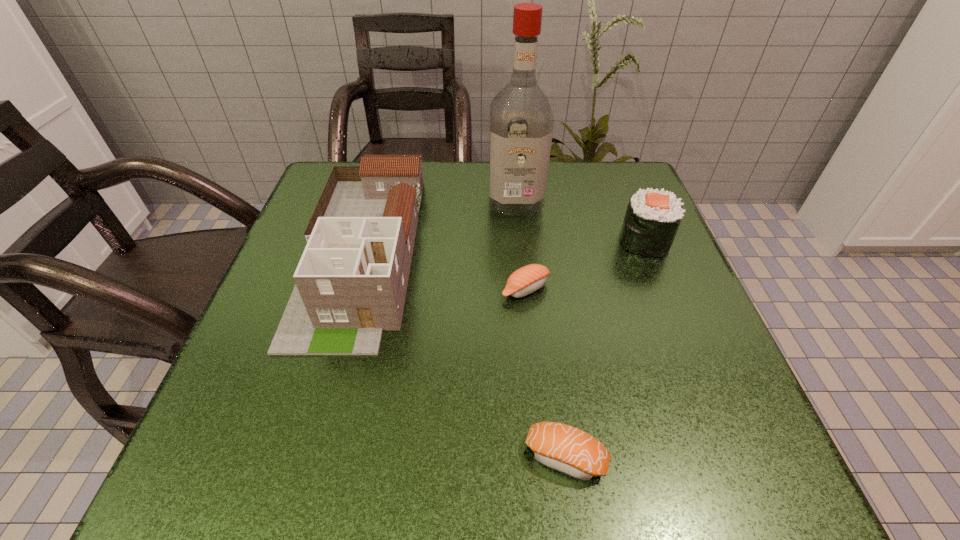
Where is `free space that satisfies the following two spatial constraints: 1. at the main entrance of the leftmost object; 2. on the right side of the second farthest sushi`? This screenshot has width=960, height=540. free space that satisfies the following two spatial constraints: 1. at the main entrance of the leftmost object; 2. on the right side of the second farthest sushi is located at coordinates (351, 289).

At what (x,y) coordinates should I click in order to perform the action: click on blank area in the image that satisfies the following two spatial constraints: 1. on the back side of the third tallest object; 2. on the left side of the second farthest sushi. Please return your answer as a coordinate pair (x, y). The height and width of the screenshot is (540, 960). Looking at the image, I should click on (520, 241).